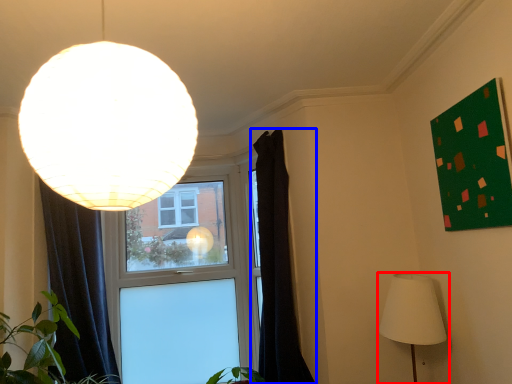
Question: Which of the following is the farthest to the observer, lamp (highlighted by a red box) or curtain (highlighted by a blue box)?

Choices:
 (A) lamp
 (B) curtain

Answer: (B)